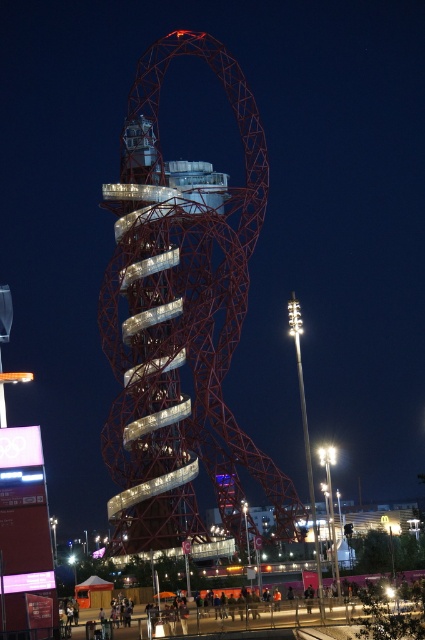
Who is positioned more to the left, metallic red tower at center or metallic amusement park at lower center?

metallic red tower at center is more to the left.

Is metallic red tower at center taller than metallic amusement park at lower center?

Indeed, metallic red tower at center has a greater height compared to metallic amusement park at lower center.

Where is `metallic red tower at center`? metallic red tower at center is located at coordinates (181, 317).